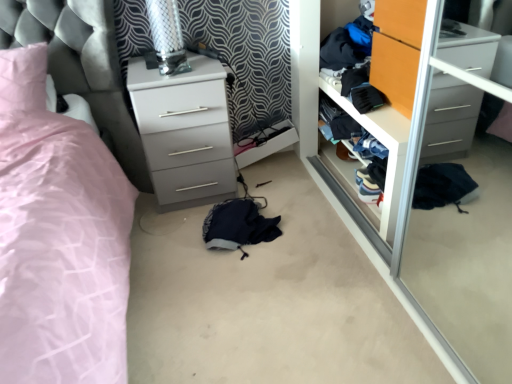
Question: Could you tell me if white glossy chest of drawers at center is facing wooden closet door at center?

Choices:
 (A) yes
 (B) no

Answer: (B)

Question: From the image's perspective, does white glossy chest of drawers at center appear higher than wooden closet door at center?

Choices:
 (A) yes
 (B) no

Answer: (A)

Question: Is white glossy chest of drawers at center to the right of wooden closet door at center from the viewer's perspective?

Choices:
 (A) yes
 (B) no

Answer: (B)

Question: From the image's perspective, is white glossy chest of drawers at center below wooden closet door at center?

Choices:
 (A) yes
 (B) no

Answer: (B)

Question: Can you confirm if white glossy chest of drawers at center is bigger than wooden closet door at center?

Choices:
 (A) yes
 (B) no

Answer: (A)

Question: Is point (389, 23) positioned closer to the camera than point (239, 203)?

Choices:
 (A) closer
 (B) farther

Answer: (A)

Question: Is orange wood wardrobe at center bigger or smaller than navy blue fabric at center?

Choices:
 (A) big
 (B) small

Answer: (B)

Question: Which is correct: orange wood wardrobe at center is inside navy blue fabric at center, or outside of it?

Choices:
 (A) outside
 (B) inside

Answer: (A)

Question: Visually, is orange wood wardrobe at center positioned to the left or to the right of navy blue fabric at center?

Choices:
 (A) left
 (B) right

Answer: (B)

Question: From the image's perspective, is wooden closet door at center above or below orange wood wardrobe at center?

Choices:
 (A) below
 (B) above

Answer: (A)

Question: From a real-world perspective, is wooden closet door at center above or below orange wood wardrobe at center?

Choices:
 (A) above
 (B) below

Answer: (B)

Question: Is wooden closet door at center bigger or smaller than orange wood wardrobe at center?

Choices:
 (A) big
 (B) small

Answer: (A)

Question: Is wooden closet door at center taller or shorter than orange wood wardrobe at center?

Choices:
 (A) tall
 (B) short

Answer: (A)

Question: Which is correct: white glossy chest of drawers at center is inside wooden closet door at center, or outside of it?

Choices:
 (A) outside
 (B) inside

Answer: (A)

Question: Based on their positions, is white glossy chest of drawers at center located to the left or right of wooden closet door at center?

Choices:
 (A) right
 (B) left

Answer: (B)